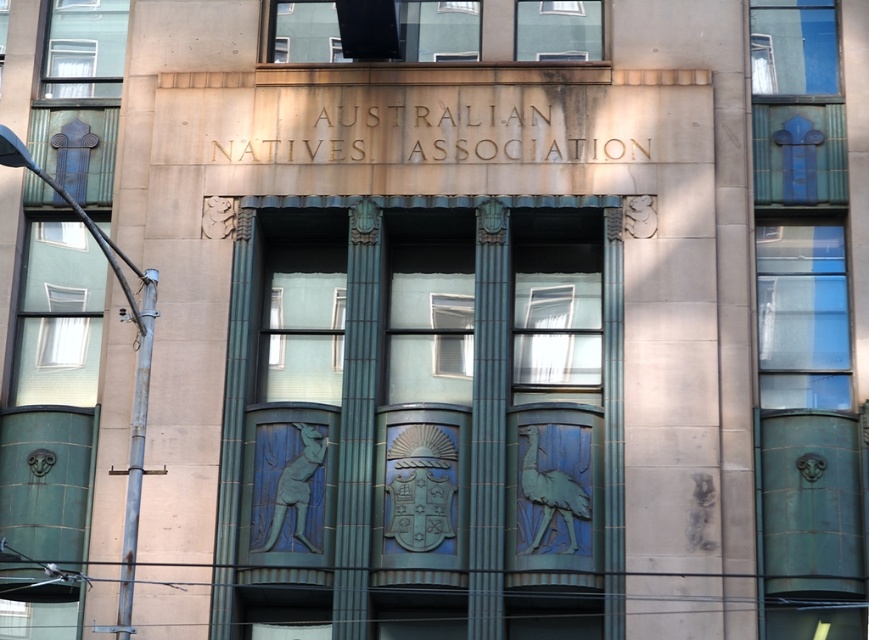
You are an architect reviewing the building facade. You notice the blue glazed tiles at center and the white glass window at left. Which object occupies a greater area on the facade?

The blue glazed tiles at center is larger in size than the white glass window at left, so the blue glazed tiles at center occupies a greater area on the facade.

You are an architect planning to install a new decorative element between the blue glazed tiles at center and the clear glass window at upper center. Based on their widths, which object should you consider for placement next to the narrower one?

The clear glass window at upper center is narrower than the blue glazed tiles at center, so you should place the new decorative element next to the clear glass window at upper center.